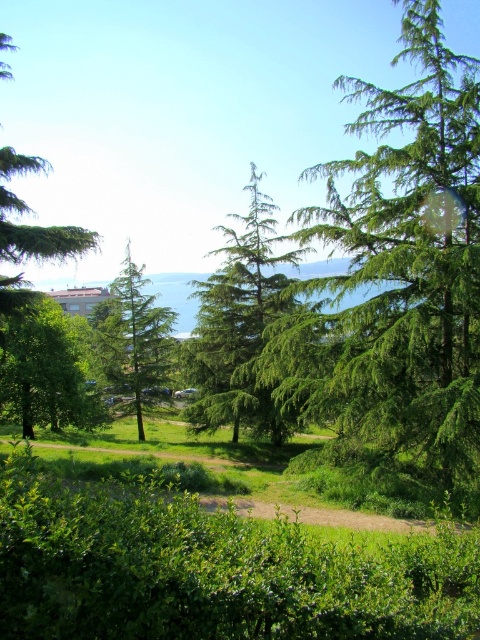
You are standing on the dirt path in the park and want to take a photo of both the green leafy tree at left and the green matte tree at upper left. Which tree should you adjust your camera focus on first to ensure both are in the frame?

You should focus on the green leafy tree at left first since it is closer to you than the green matte tree at upper left, ensuring both are within the camera frame.

You are standing at the center of the dirt path in the midground. Which direction should you walk to reach the green leafy tree at left?

The green leafy tree at left is located at point coordinates that place it to the left side of the scene, so you should walk to your left to reach it.